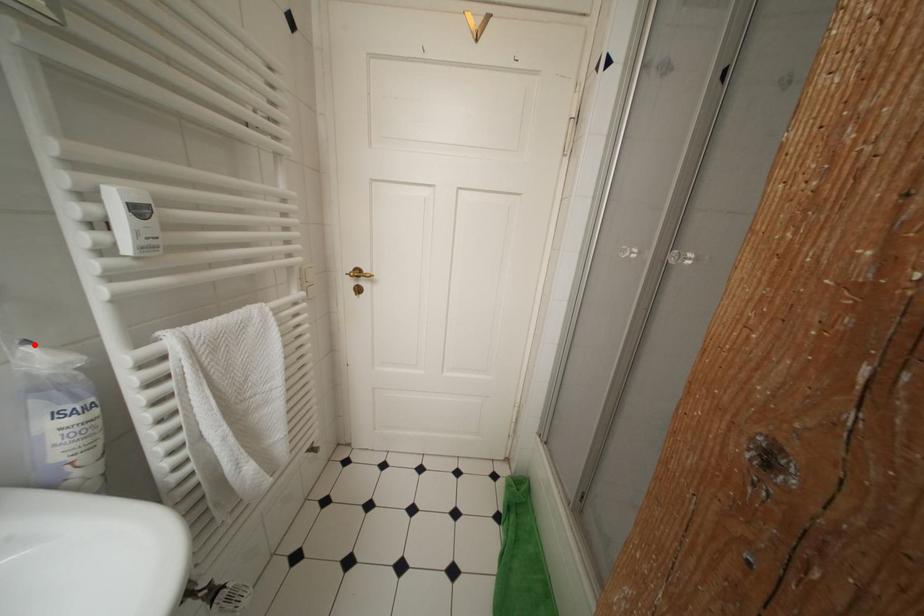
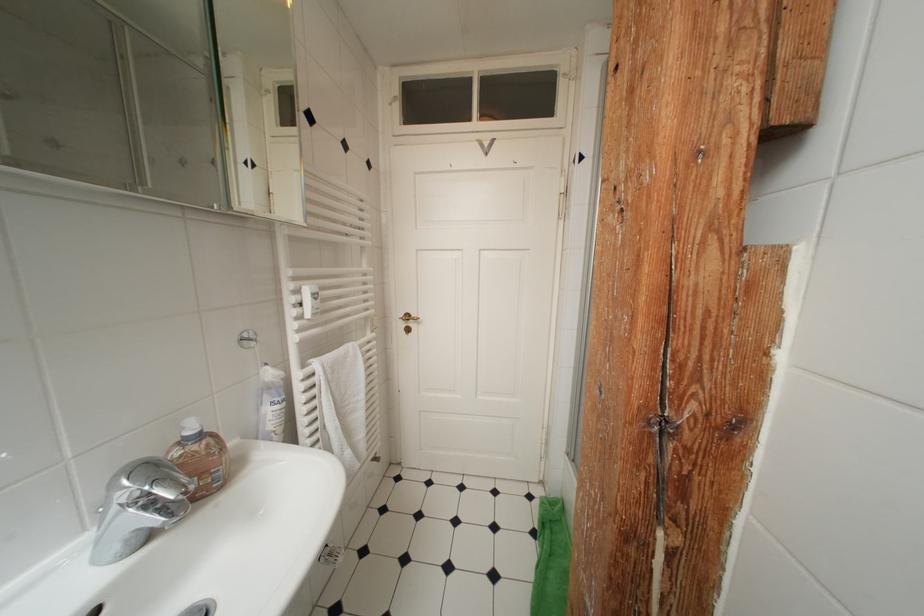
Find the pixel in the second image that matches the highlighted location in the first image.

(274, 368)